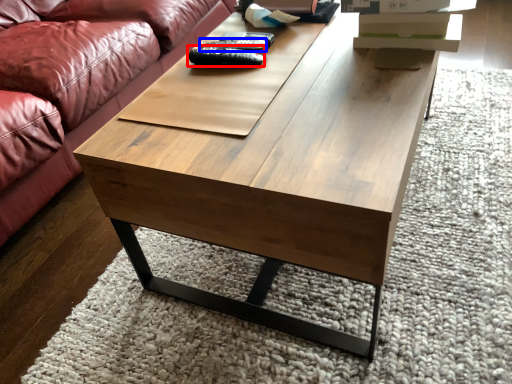
Question: Which point is closer to the camera, remote (highlighted by a red box) or remote (highlighted by a blue box)?

Choices:
 (A) remote
 (B) remote

Answer: (A)